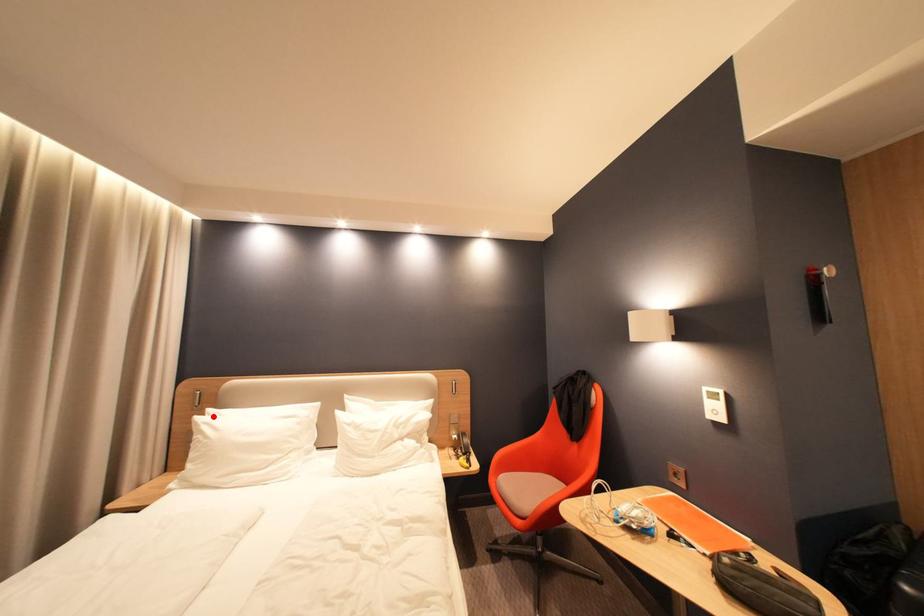
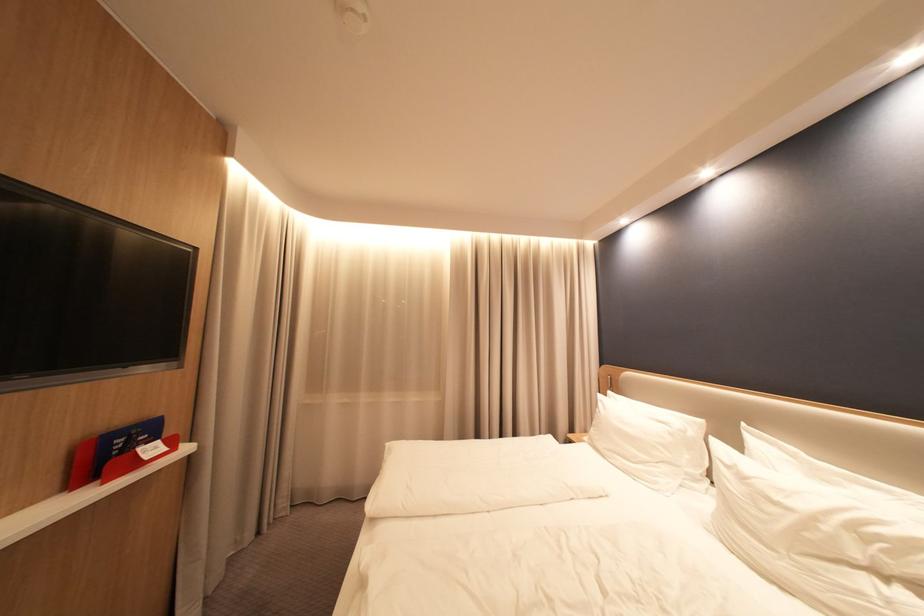
Where in the second image is the point corresponding to the highlighted location from the first image?

(615, 397)